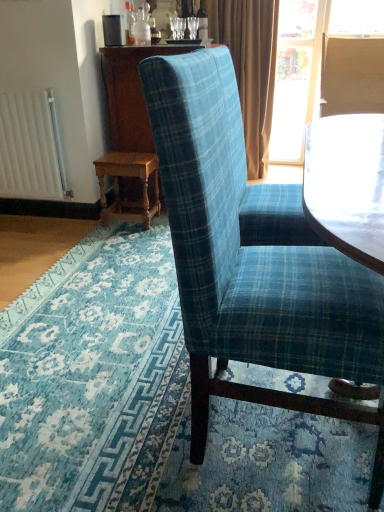
Question: Does matte brown curtain at upper right appear on the right side of blue plaid fabric at center?

Choices:
 (A) yes
 (B) no

Answer: (A)

Question: Does matte brown curtain at upper right have a lesser height compared to blue plaid fabric at center?

Choices:
 (A) no
 (B) yes

Answer: (A)

Question: Is matte brown curtain at upper right at the left side of blue plaid fabric at center?

Choices:
 (A) no
 (B) yes

Answer: (A)

Question: Is matte brown curtain at upper right far away from blue plaid fabric at center?

Choices:
 (A) yes
 (B) no

Answer: (A)

Question: Considering the relative positions of matte brown curtain at upper right and blue plaid fabric at center in the image provided, is matte brown curtain at upper right behind blue plaid fabric at center?

Choices:
 (A) yes
 (B) no

Answer: (A)

Question: Choose the correct answer: Is white matte radiator at left inside blue plaid fabric chair at center or outside it?

Choices:
 (A) outside
 (B) inside

Answer: (A)

Question: Considering the positions of white matte radiator at left and blue plaid fabric chair at center in the image, is white matte radiator at left bigger or smaller than blue plaid fabric chair at center?

Choices:
 (A) big
 (B) small

Answer: (B)

Question: From a real-world perspective, is white matte radiator at left positioned above or below blue plaid fabric chair at center?

Choices:
 (A) below
 (B) above

Answer: (A)

Question: Considering the positions of point (28, 172) and point (259, 314), is point (28, 172) closer or farther from the camera than point (259, 314)?

Choices:
 (A) farther
 (B) closer

Answer: (A)

Question: Is wooden table at lower left bigger or smaller than wooden dresser at center?

Choices:
 (A) big
 (B) small

Answer: (B)

Question: Is wooden table at lower left inside or outside of wooden dresser at center?

Choices:
 (A) inside
 (B) outside

Answer: (B)

Question: Visually, is wooden table at lower left positioned to the left or to the right of wooden dresser at center?

Choices:
 (A) left
 (B) right

Answer: (A)

Question: From the image's perspective, is wooden table at lower left located above or below wooden dresser at center?

Choices:
 (A) above
 (B) below

Answer: (B)

Question: From the image's perspective, relative to blue plaid fabric chair at center, is matte brown curtain at upper right above or below?

Choices:
 (A) above
 (B) below

Answer: (A)

Question: Would you say matte brown curtain at upper right is inside or outside blue plaid fabric chair at center?

Choices:
 (A) outside
 (B) inside

Answer: (A)